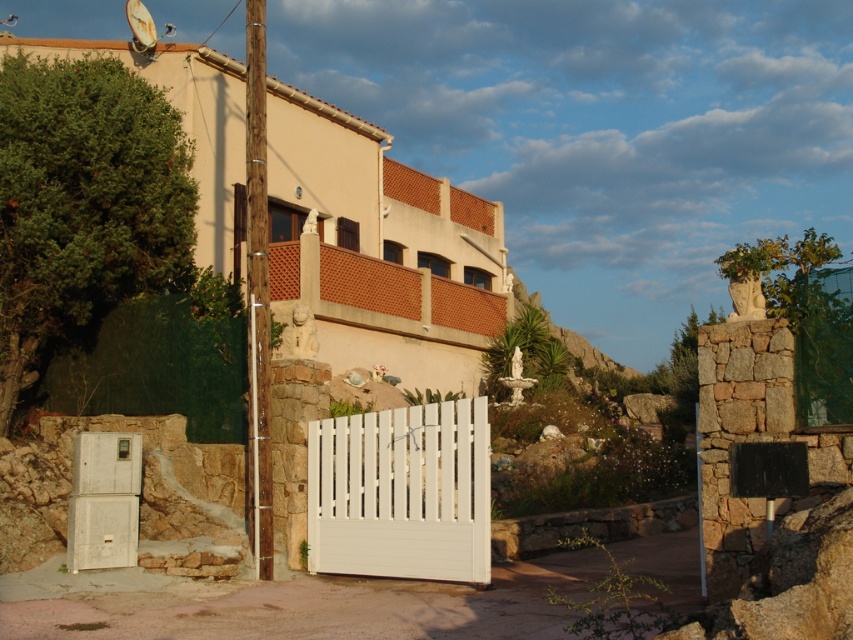
Question: Can you confirm if white painted wood gate at center is smaller than white matte refrigerator at lower left?

Choices:
 (A) no
 (B) yes

Answer: (A)

Question: Which point appears farthest from the camera in this image?

Choices:
 (A) (80, 500)
 (B) (352, 566)

Answer: (B)

Question: Is white painted wood gate at center in front of white matte refrigerator at lower left?

Choices:
 (A) yes
 (B) no

Answer: (A)

Question: Which point is farther to the camera?

Choices:
 (A) (102, 556)
 (B) (486, 500)

Answer: (A)

Question: Can you confirm if white painted wood gate at center is wider than white matte refrigerator at lower left?

Choices:
 (A) yes
 (B) no

Answer: (A)